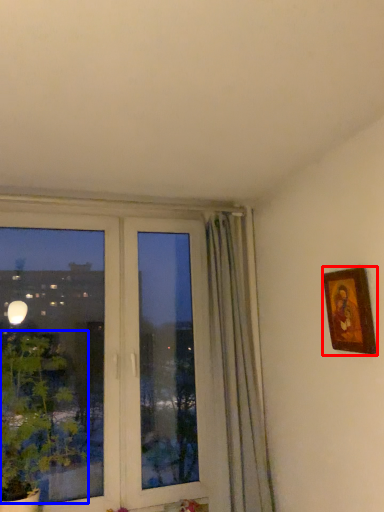
Question: Which object is further to the camera taking this photo, picture frame (highlighted by a red box) or plant (highlighted by a blue box)?

Choices:
 (A) picture frame
 (B) plant

Answer: (B)